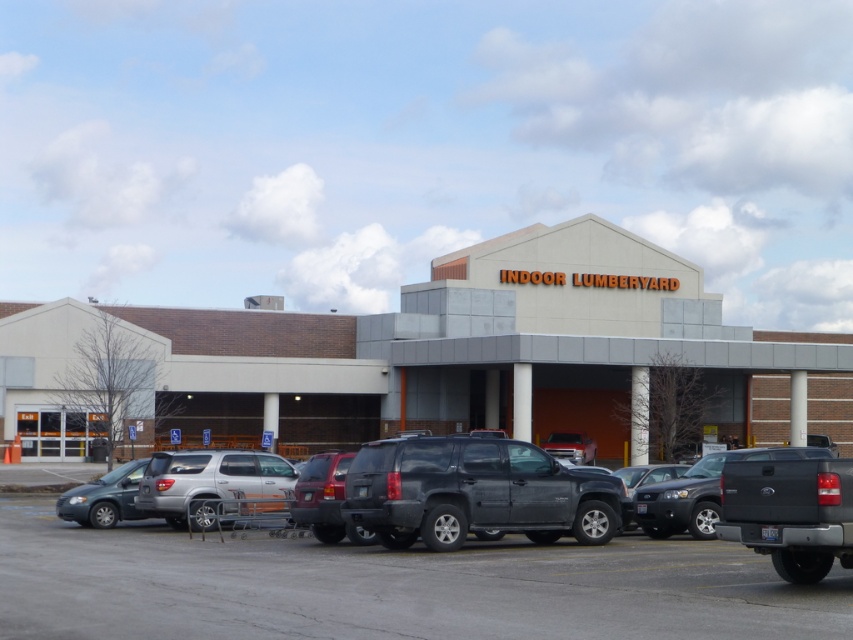
Question: Can you confirm if satin silver suv at center is positioned to the right of matte black sedan at center?

Choices:
 (A) no
 (B) yes

Answer: (A)

Question: Is matte black suv at center in front of satin silver suv at center?

Choices:
 (A) yes
 (B) no

Answer: (A)

Question: Among these objects, which one is farthest from the camera?

Choices:
 (A) matte black suv at center
 (B) brick building at center

Answer: (B)

Question: Which point is closer to the camera taking this photo?

Choices:
 (A) (772, 579)
 (B) (138, 484)
 (C) (395, 522)
 (D) (650, 467)

Answer: (A)

Question: Does matte black suv at center have a larger size compared to satin silver suv at center?

Choices:
 (A) yes
 (B) no

Answer: (A)

Question: Among these objects, which one is farthest from the camera?

Choices:
 (A) matte black sedan at center
 (B) matte gray minivan at lower left
 (C) satin silver suv at center

Answer: (B)